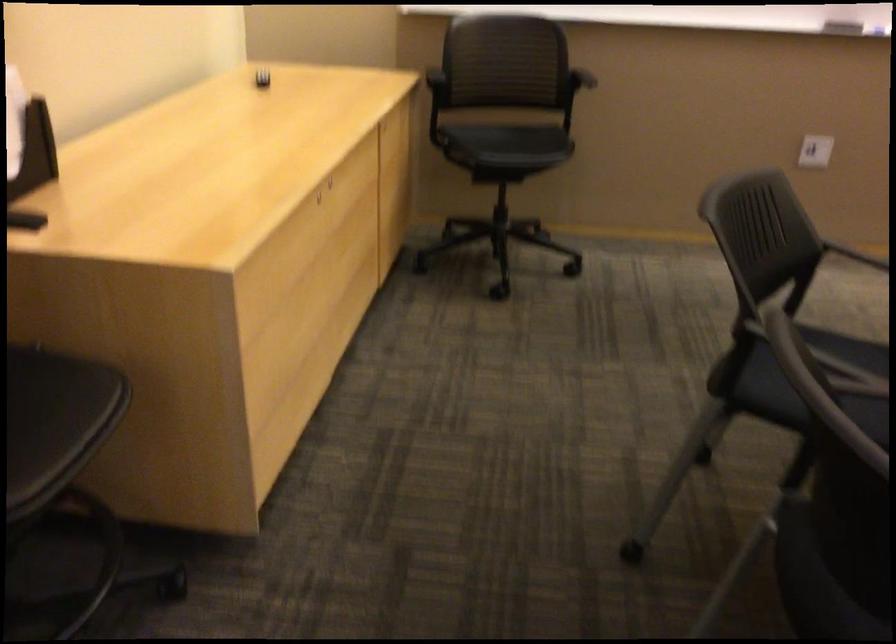
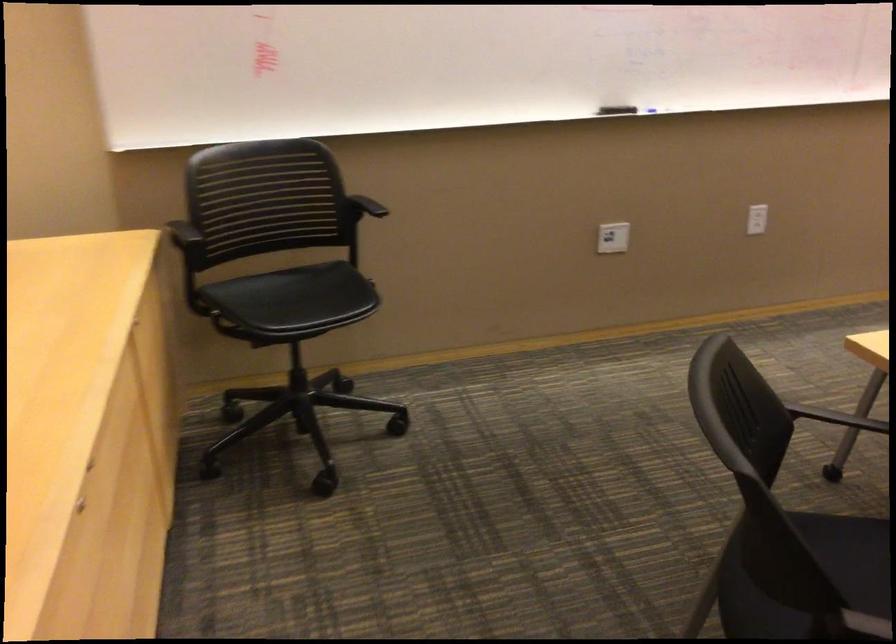
Where in the second image is the point corresponding to (x=583, y=76) from the first image?

(366, 205)